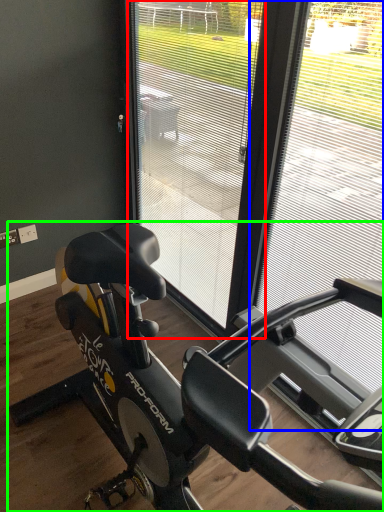
Question: Estimate the real-world distances between objects in this image. Which object is farther from screen door (highlighted by a red box), window frame (highlighted by a blue box) or stationary bicycle (highlighted by a green box)?

Choices:
 (A) window frame
 (B) stationary bicycle

Answer: (B)